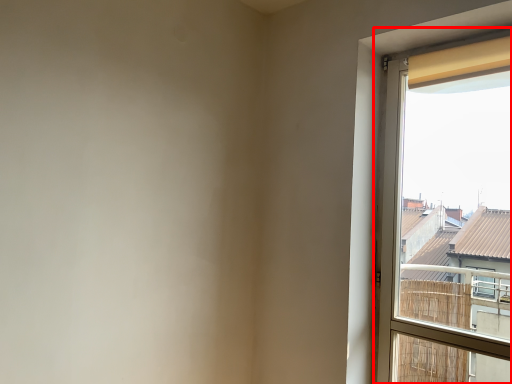
Question: Where is window (annotated by the red box) located in relation to curtain in the image?

Choices:
 (A) right
 (B) left

Answer: (B)